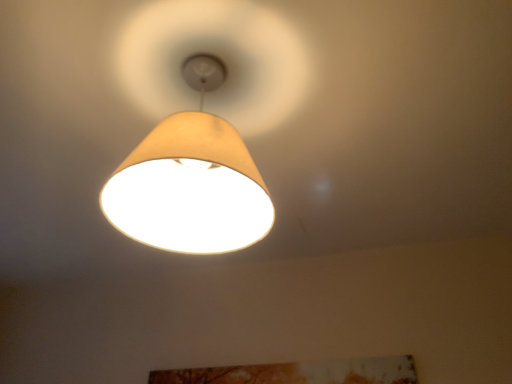
Image resolution: width=512 pixels, height=384 pixels. I want to click on matte beige lampshade at center, so click(x=191, y=180).

Describe the element at coordinates (191, 180) in the screenshot. I see `matte beige lampshade at center` at that location.

What is the approximate width of matte beige lampshade at center?

matte beige lampshade at center is 29.75 centimeters wide.

In order to face matte beige lampshade at center, should I rotate leftwards or rightwards?

Turn left approximately 7.502 degrees to face it.

Locate an element on the screen. matte beige lampshade at center is located at coordinates (191, 180).